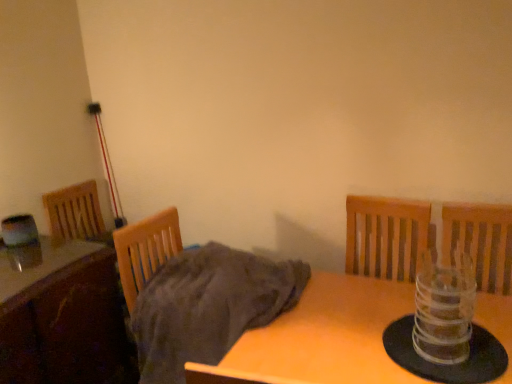
Locate an element on the screen. vacant area on top of wooden table at center, marked as the second table in a left-to-right arrangement (from a real-world perspective) is located at coordinates (365, 333).